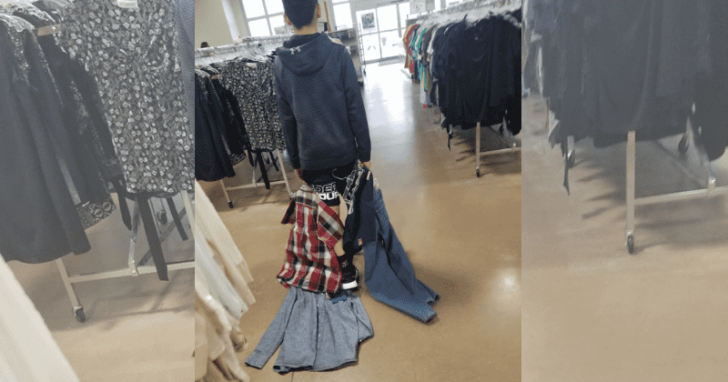
At what (x,y) coordinates should I click in order to perform the action: click on white frame aroudn windows. Please return your answer as a coordinate pair (x, y). The height and width of the screenshot is (382, 728). Looking at the image, I should click on (268, 16).